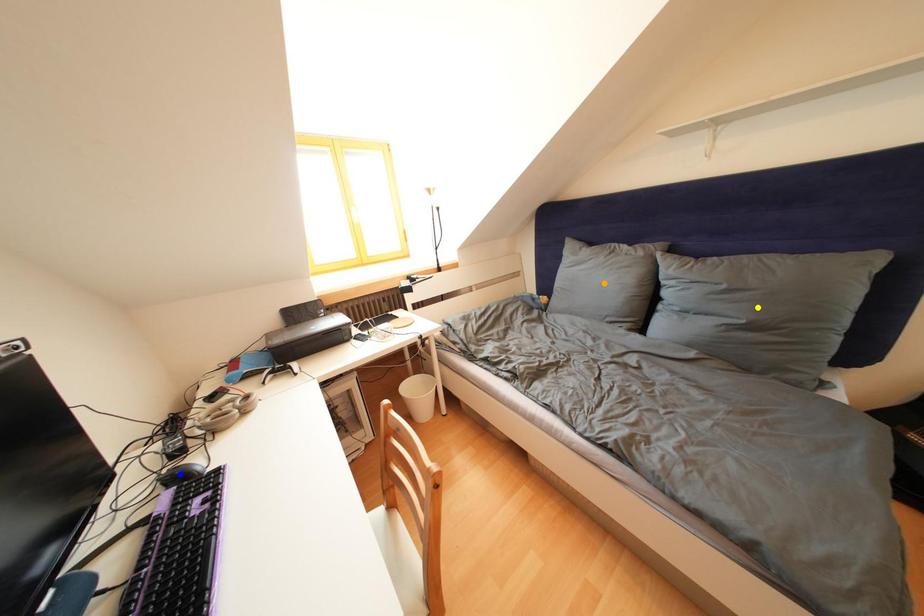
Order these from nearest to farthest:
yellow point, orange point, blue point

1. orange point
2. yellow point
3. blue point